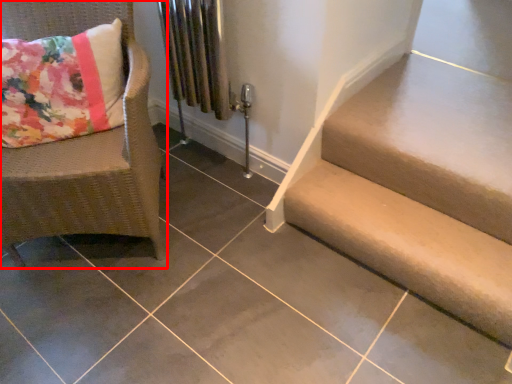
Question: From the image's perspective, where is chair (annotated by the red box) located in relation to stairs in the image?

Choices:
 (A) above
 (B) below

Answer: (A)